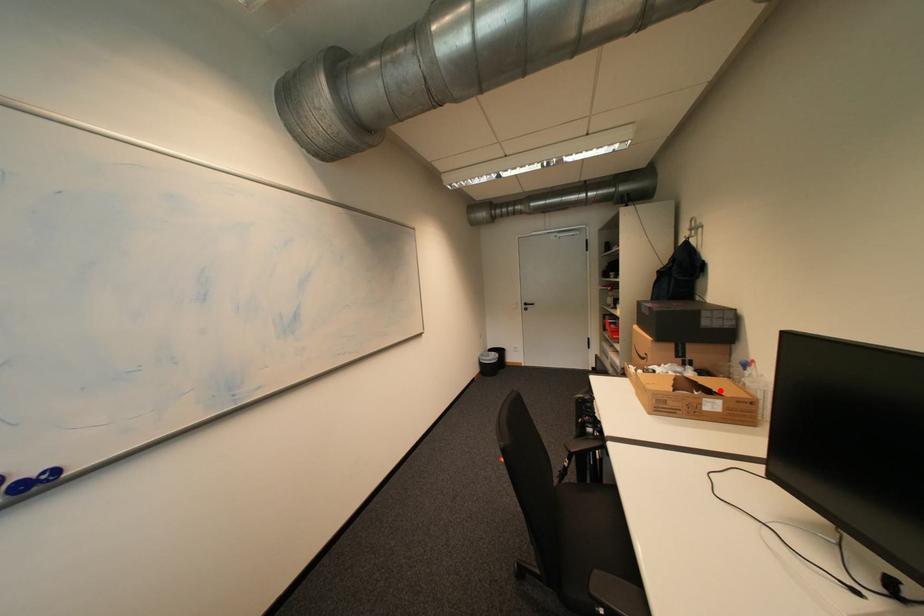
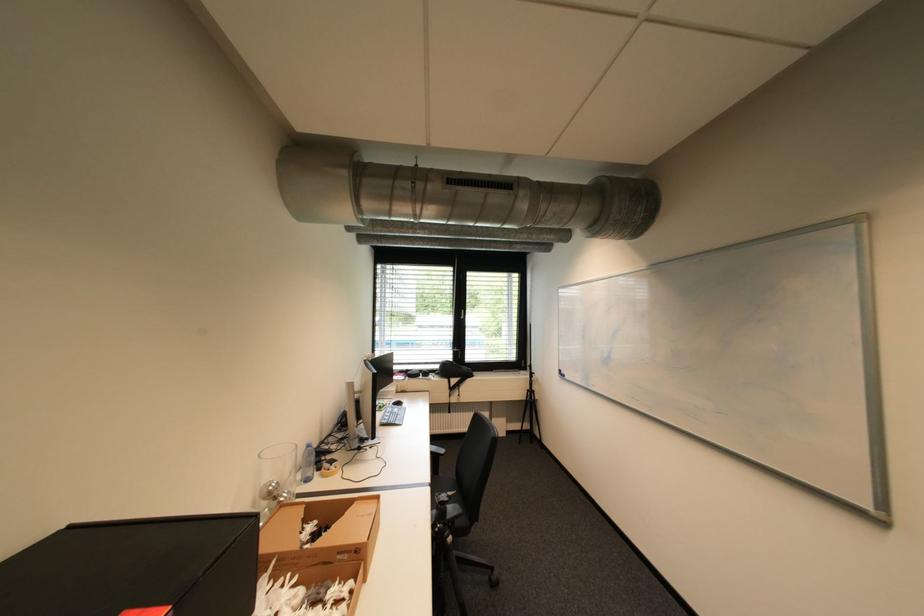
Where in the second image is the point corresponding to the highlighted location from the first image?

(311, 520)